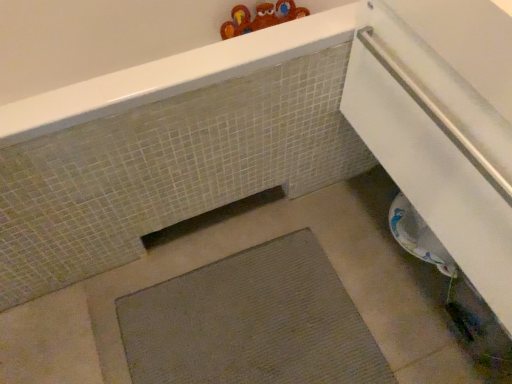
Question: In terms of width, does white glossy towel at lower right look wider or thinner when compared to matte gray mat at lower center?

Choices:
 (A) wide
 (B) thin

Answer: (B)

Question: Is white glossy towel at lower right bigger or smaller than matte gray mat at lower center?

Choices:
 (A) big
 (B) small

Answer: (B)

Question: Which is farther from the gray textured bath mat at center?

Choices:
 (A) matte gray mat at lower center
 (B) white glossy towel at lower right

Answer: (B)

Question: Estimate the real-world distances between objects in this image. Which object is farther from the white glossy towel at lower right?

Choices:
 (A) gray textured bath mat at center
 (B) matte gray mat at lower center

Answer: (A)